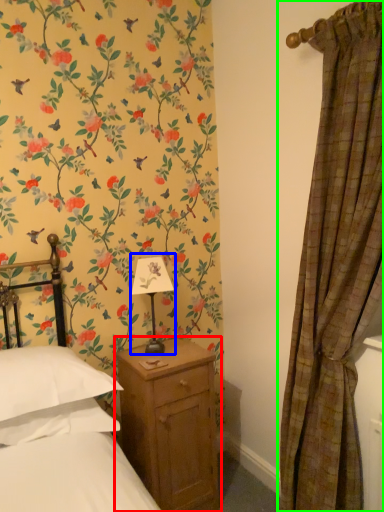
Question: Which is farther away from nightstand (highlighted by a red box)? table lamp (highlighted by a blue box) or curtain (highlighted by a green box)?

Choices:
 (A) table lamp
 (B) curtain

Answer: (B)